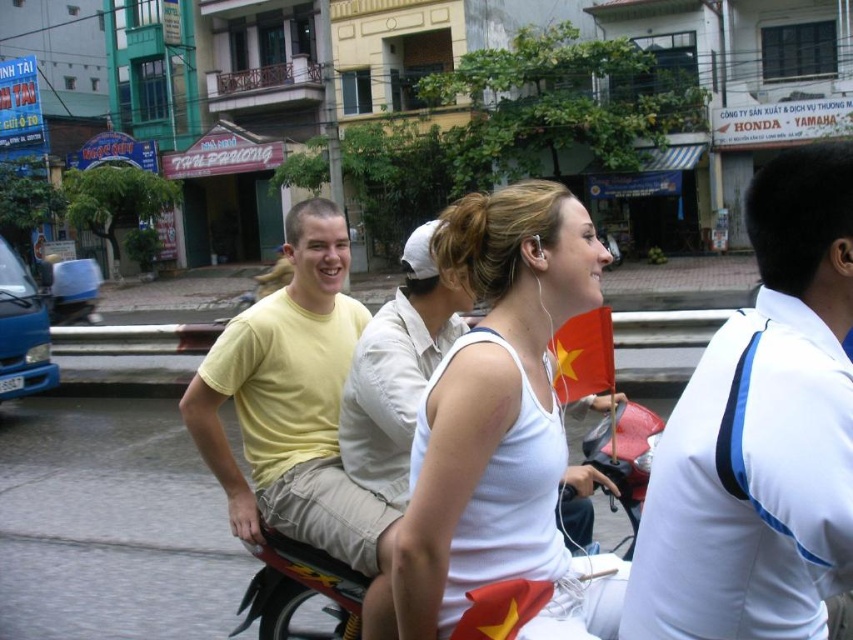
You are a photographer standing on the sidewalk. You want to take a photo of the metallic red motorcycle at center and the white smooth shirt at right. Which object should you focus on first if you want to capture both in the same frame without moving the camera?

The white smooth shirt at right is smaller in size compared to the metallic red motorcycle at center, so you should focus on the metallic red motorcycle at center first as it is larger and more prominent in the scene.

You are a fashion designer observing a street scene in Vietnam. You notice two clothing items on the people there. Which clothing item is smaller in size between the white smooth shirt at right and the white matte tank top at center?

The white smooth shirt at right is smaller than the white matte tank top at center.